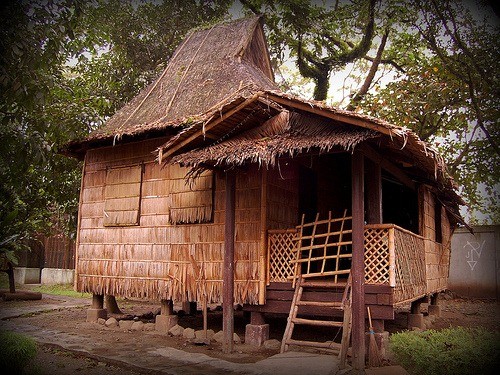
I want to click on stairs, so click(x=51, y=256), click(x=322, y=349), click(x=315, y=322), click(x=321, y=305), click(x=325, y=285).